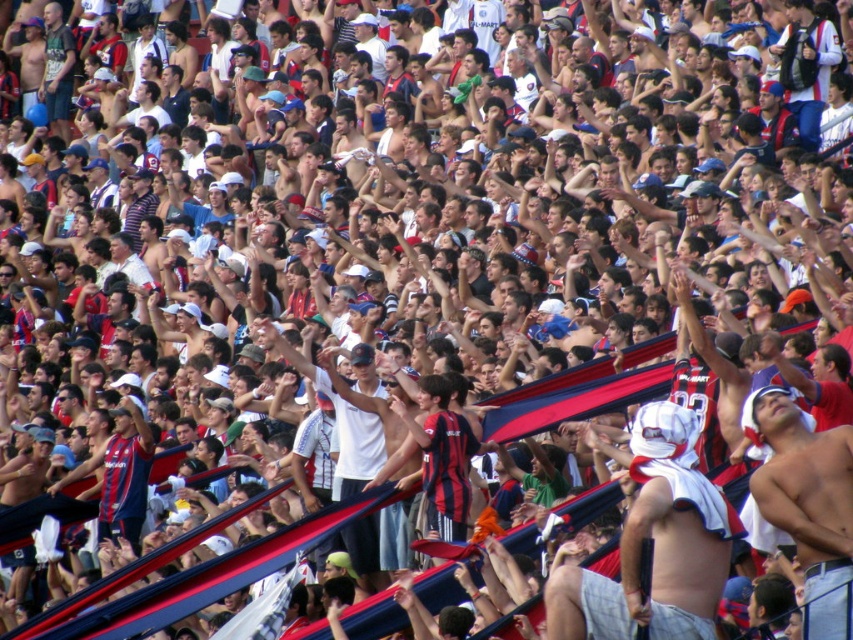
You are a photographer at the stadium and want to capture a photo of both the white fabric headband at center and the shiny white towel at center. Which object should you focus on first if you want to include both in your frame without moving the camera?

The white fabric headband at center is positioned on the left side of the shiny white towel at center, so you should focus on the white fabric headband at center first to ensure both are in the frame.

You are a photographer at the stadium and want to capture a clear photo of the white fabric headband at center without the shiny white towel at center blocking it. What should you do?

Move your position forward so that the shiny white towel at center is no longer behind the white fabric headband at center, allowing for an unobstructed view of the headband.

You are a photographer at the stadium and want to capture both the white fabric headband at center and the shiny white towel at center in your shot. Which object should you focus on first to ensure it appears larger in the photo?

The white fabric headband at center is taller than the shiny white towel at center, so focusing on the white fabric headband at center first will ensure it appears larger in the photo.